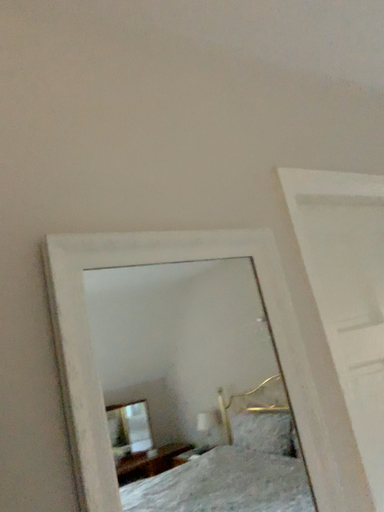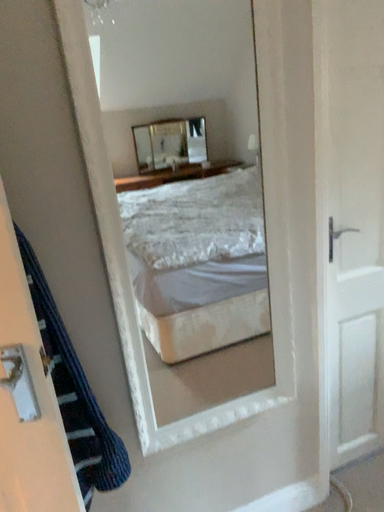
Question: Which way did the camera rotate in the video?

Choices:
 (A) rotated upward
 (B) rotated downward

Answer: (B)